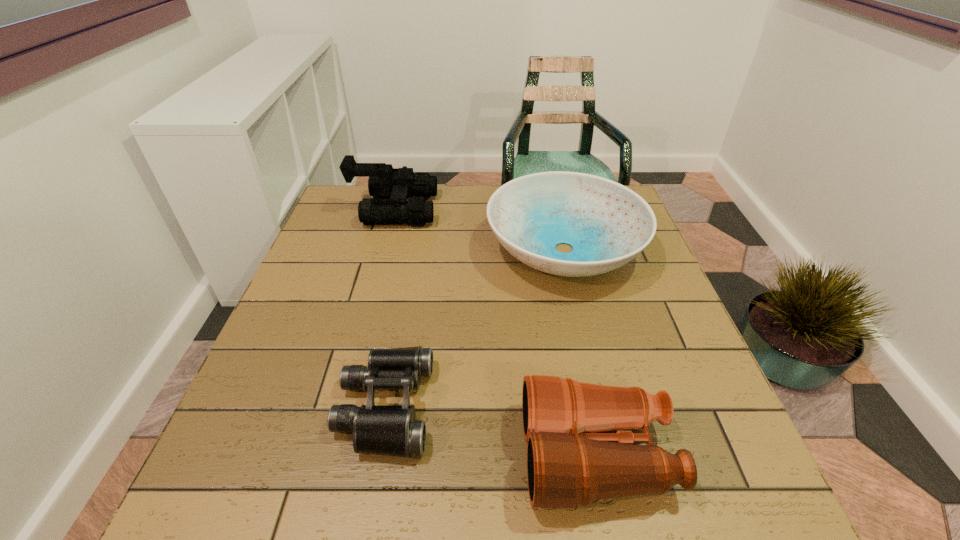
Locate an element on the screen. This screenshot has width=960, height=540. vacant space at the far edge of the desktop is located at coordinates (451, 201).

I want to click on vacant area at the near edge of the desktop, so click(x=376, y=522).

In order to click on vacant space at the left edge of the desktop in this screenshot , I will do `click(237, 455)`.

Identify the location of free space at the right edge of the desktop. (649, 249).

Image resolution: width=960 pixels, height=540 pixels. What are the coordinates of `vacant region at the far left corner of the desktop` in the screenshot? It's located at (350, 190).

Image resolution: width=960 pixels, height=540 pixels. In order to click on free space between the dish and the shortest object in this screenshot , I will do `click(474, 328)`.

Image resolution: width=960 pixels, height=540 pixels. Find the location of `empty space that is in between the dish and the rightmost binoculars`. empty space that is in between the dish and the rightmost binoculars is located at coordinates (580, 352).

This screenshot has height=540, width=960. Find the location of `free spot between the shortest binoculars and the dish`. free spot between the shortest binoculars and the dish is located at coordinates 474,328.

Where is `free spot between the tallest binoculars and the shortest binoculars`? Image resolution: width=960 pixels, height=540 pixels. free spot between the tallest binoculars and the shortest binoculars is located at coordinates (390, 308).

Where is `vacant area between the tallest binoculars and the rightmost binoculars`? The image size is (960, 540). vacant area between the tallest binoculars and the rightmost binoculars is located at coordinates (495, 332).